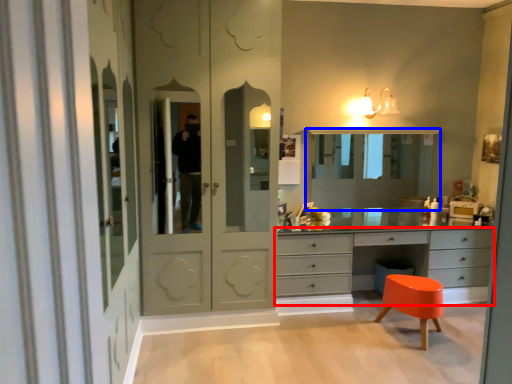
Question: Which object is further to the camera taking this photo, chest of drawers (highlighted by a red box) or medicine cabinet (highlighted by a blue box)?

Choices:
 (A) chest of drawers
 (B) medicine cabinet

Answer: (B)